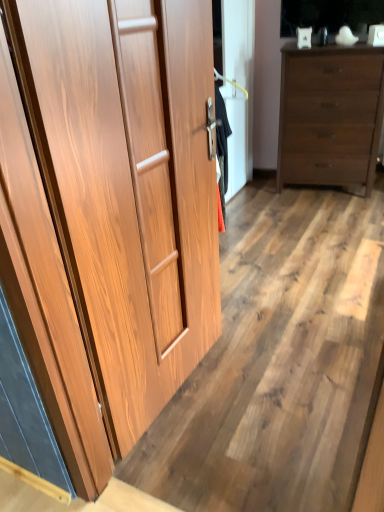
Question: Considering the relative positions of matte brown dresser at right and wooden floor at center in the image provided, is matte brown dresser at right to the right of wooden floor at center from the viewer's perspective?

Choices:
 (A) no
 (B) yes

Answer: (B)

Question: Is matte brown dresser at right facing towards wooden floor at center?

Choices:
 (A) yes
 (B) no

Answer: (A)

Question: Does matte brown dresser at right contain wooden floor at center?

Choices:
 (A) no
 (B) yes

Answer: (A)

Question: From a real-world perspective, does matte brown dresser at right stand above wooden floor at center?

Choices:
 (A) yes
 (B) no

Answer: (A)

Question: Considering the relative sizes of matte brown dresser at right and wooden floor at center in the image provided, is matte brown dresser at right thinner than wooden floor at center?

Choices:
 (A) no
 (B) yes

Answer: (B)

Question: In terms of width, does wooden floor at center look wider or thinner when compared to matte brown dresser at right?

Choices:
 (A) wide
 (B) thin

Answer: (A)

Question: Considering their positions, is wooden floor at center located in front of or behind matte brown dresser at right?

Choices:
 (A) behind
 (B) front

Answer: (B)

Question: Choose the correct answer: Is wooden floor at center inside matte brown dresser at right or outside it?

Choices:
 (A) outside
 (B) inside

Answer: (A)

Question: Is point (x=311, y=259) closer or farther from the camera than point (x=306, y=59)?

Choices:
 (A) farther
 (B) closer

Answer: (B)

Question: Is wooden floor at center wider or thinner than wooden cupboard at left?

Choices:
 (A) wide
 (B) thin

Answer: (A)

Question: Is wooden floor at center spatially inside wooden cupboard at left, or outside of it?

Choices:
 (A) outside
 (B) inside

Answer: (A)

Question: Does point (345, 281) appear closer or farther from the camera than point (200, 177)?

Choices:
 (A) farther
 (B) closer

Answer: (A)

Question: Considering the relative positions of wooden floor at center and wooden cupboard at left in the image provided, is wooden floor at center to the left or to the right of wooden cupboard at left?

Choices:
 (A) left
 (B) right

Answer: (B)

Question: Considering the positions of wooden cupboard at left and matte brown dresser at right in the image, is wooden cupboard at left taller or shorter than matte brown dresser at right?

Choices:
 (A) tall
 (B) short

Answer: (A)

Question: From the image's perspective, relative to matte brown dresser at right, is wooden cupboard at left above or below?

Choices:
 (A) below
 (B) above

Answer: (A)